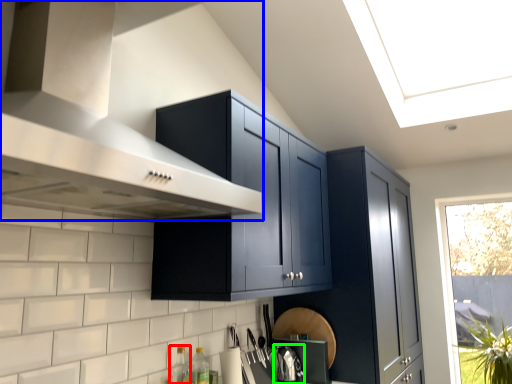
Question: Which object is positioned farthest from bottle (highlighted by a red box)? Select from vent (highlighted by a blue box) and appliance (highlighted by a green box).

Choices:
 (A) vent
 (B) appliance

Answer: (A)